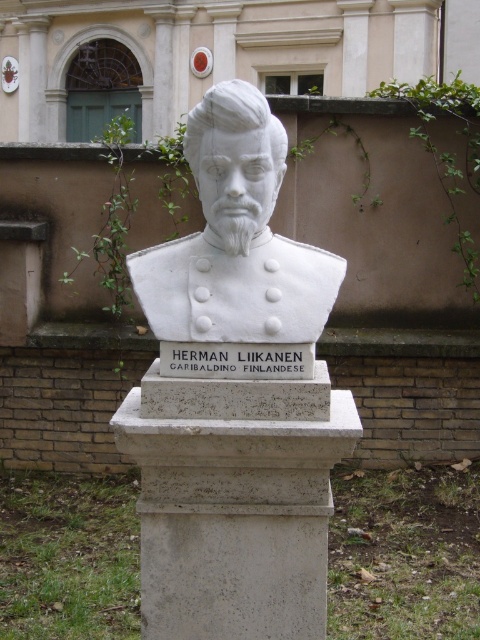
Is white marble bust at center taller than white stone sign at center?

Indeed, white marble bust at center has a greater height compared to white stone sign at center.

Who is more forward, (203, 564) or (243, 369)?

Point (243, 369) is more forward.

Identify the location of white marble bust at center. (235, 500).

Is white marble bust at center thinner than white stone bust at center?

In fact, white marble bust at center might be wider than white stone bust at center.

Is point (222, 209) behind point (262, 196)?

That is False.

Between point (192, 269) and point (208, 272), which one is positioned behind?

Point (192, 269)

Where is `white marble bust at center`? This screenshot has width=480, height=640. white marble bust at center is located at coordinates (235, 500).

Identify the location of white stone bust at center. click(x=236, y=237).

Consider the image. Who is shorter, white stone bust at center or white stone sign at center?

Standing shorter between the two is white stone sign at center.

The width and height of the screenshot is (480, 640). I want to click on white stone bust at center, so click(236, 237).